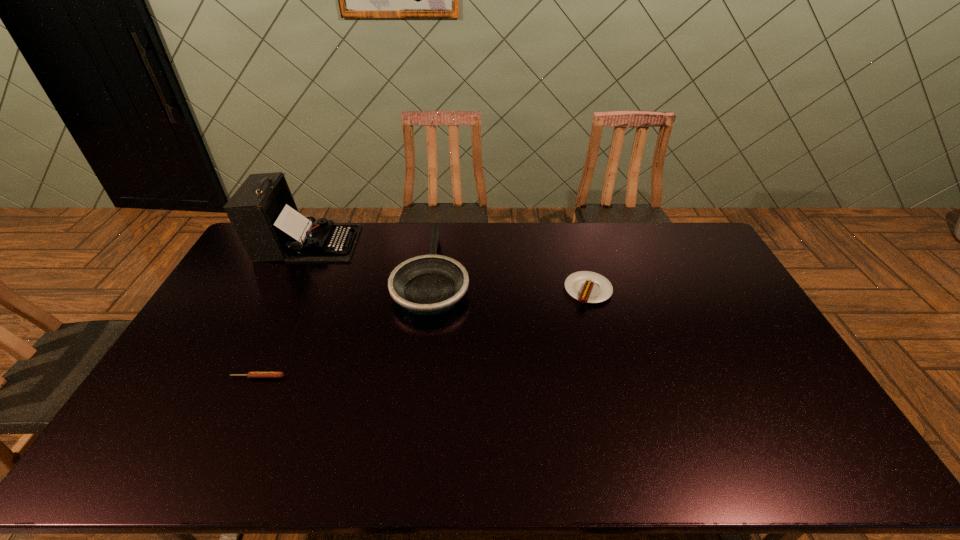
I want to click on vacant area in the image that satisfies the following two spatial constraints: 1. on the back side of the left sausage; 2. inside the open case of the typewriter, so click(x=319, y=244).

I want to click on vacant space that satisfies the following two spatial constraints: 1. inside the open case of the tallest object; 2. on the handle side of the frying pan, so click(294, 273).

You are a GUI agent. You are given a task and a screenshot of the screen. Output one action in this format:
    pyautogui.click(x=<x>, y=<y>)
    Task: Click on the free point that satisfies the following two spatial constraints: 1. inside the open case of the typewriter; 2. on the left side of the shortest object
    This screenshot has width=960, height=540.
    Given the screenshot: What is the action you would take?
    pyautogui.click(x=242, y=377)

Find the location of a particular element. This screenshot has width=960, height=540. vacant region that satisfies the following two spatial constraints: 1. on the handle side of the second object from right to left; 2. inside the open case of the tallest object is located at coordinates (436, 244).

The width and height of the screenshot is (960, 540). What are the coordinates of `free space that satisfies the following two spatial constraints: 1. inside the open case of the nearest object; 2. on the left side of the tallest object` in the screenshot? It's located at (242, 377).